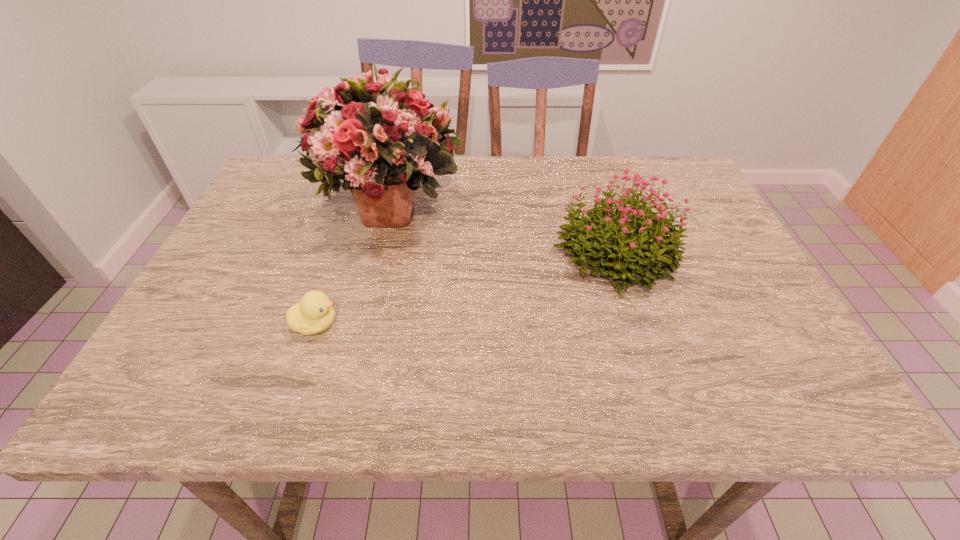
In order to click on object that is at the right edge in this screenshot , I will do `click(635, 246)`.

At what (x,y) coordinates should I click in order to perform the action: click on vacant space at the far edge. Please return your answer as a coordinate pair (x, y). Image resolution: width=960 pixels, height=540 pixels. Looking at the image, I should click on [x=490, y=196].

The height and width of the screenshot is (540, 960). Identify the location of blank area at the near edge. (325, 372).

You are a GUI agent. You are given a task and a screenshot of the screen. Output one action in this format:
    pyautogui.click(x=<x>, y=<y>)
    Task: Click on the vacant space at the right edge of the desktop
    
    Given the screenshot: What is the action you would take?
    pyautogui.click(x=757, y=309)

This screenshot has width=960, height=540. Find the location of `vacant position at the far left corner of the desktop`. vacant position at the far left corner of the desktop is located at coordinates (278, 160).

Image resolution: width=960 pixels, height=540 pixels. I want to click on vacant space at the far right corner, so click(x=664, y=188).

In the image, there is a desktop. Find the location of `vacant region at the near right corner`. vacant region at the near right corner is located at coordinates (780, 395).

The height and width of the screenshot is (540, 960). In order to click on blank region between the nearest object and the right bouquet in this screenshot , I will do `click(465, 289)`.

Where is `vacant region between the rightmost object and the taller bouquet`? The height and width of the screenshot is (540, 960). vacant region between the rightmost object and the taller bouquet is located at coordinates (502, 230).

The height and width of the screenshot is (540, 960). Find the location of `free space between the duckling and the left bouquet`. free space between the duckling and the left bouquet is located at coordinates (352, 265).